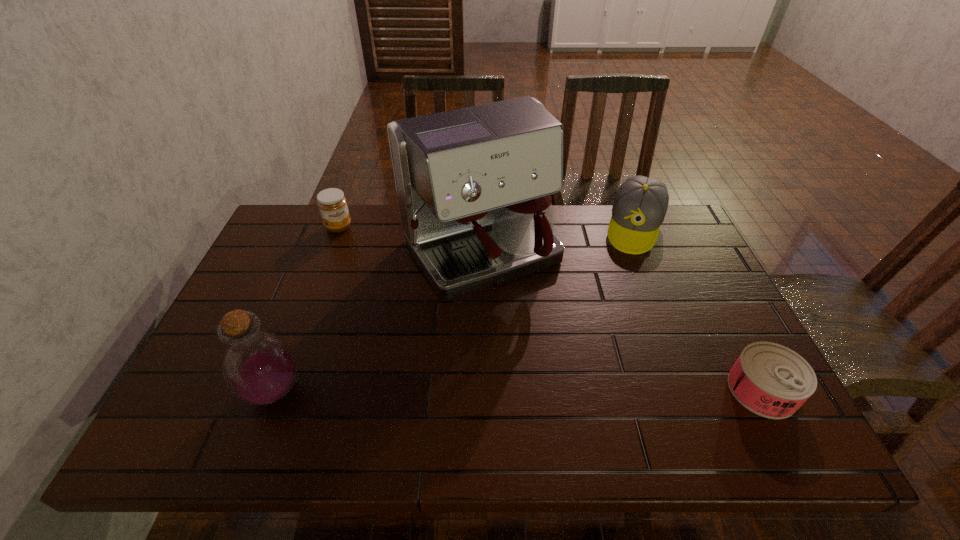
Identify the location of vacant point located between the bottle and the baseball cap. (454, 309).

Where is `free space between the fourth tallest object and the shortest object`? This screenshot has height=540, width=960. free space between the fourth tallest object and the shortest object is located at coordinates (550, 308).

Find the location of a particular element. vacant space that is in between the can and the baseball cap is located at coordinates (698, 309).

This screenshot has height=540, width=960. I want to click on the second closest object to the third object from right to left, so click(x=332, y=204).

Where is `the second closest object to the fourth tallest object`? Image resolution: width=960 pixels, height=540 pixels. the second closest object to the fourth tallest object is located at coordinates (259, 367).

The height and width of the screenshot is (540, 960). Find the location of `vacant space that satisfies the following two spatial constraints: 1. on the back side of the third tallest object; 2. on the right side of the bottle`. vacant space that satisfies the following two spatial constraints: 1. on the back side of the third tallest object; 2. on the right side of the bottle is located at coordinates (337, 228).

Locate an element on the screen. Image resolution: width=960 pixels, height=540 pixels. free location that satisfies the following two spatial constraints: 1. on the back side of the can; 2. on the right side of the bottle is located at coordinates (276, 389).